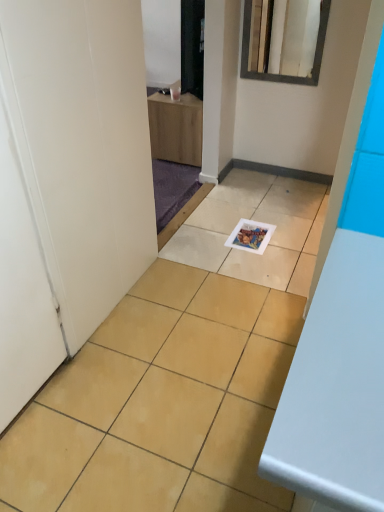
At what (x,y) coordinates should I click in order to perform the action: click on spots to the right of white matte door at left. Please return your answer as a coordinate pair (x, y). Looking at the image, I should click on (108, 389).